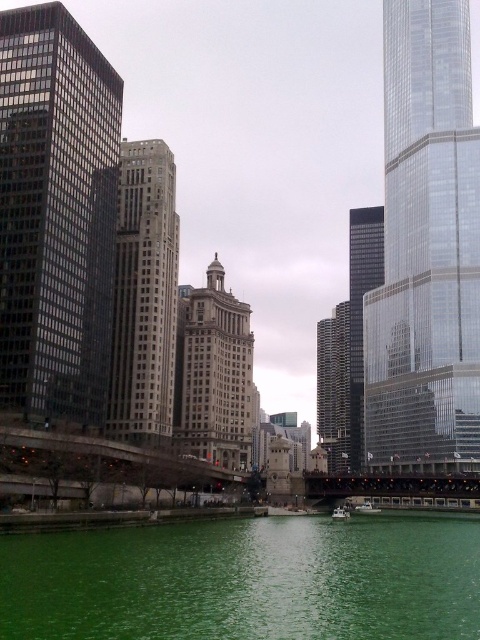
You are a photographer planning to capture the green liquid at lower center and the gray stone building at center in a single shot. Based on their heights, which object will appear smaller in the photo?

The green liquid at lower center will appear smaller in the photo because it has a lesser height compared to the gray stone building at center.

You are a photographer planning to capture the dark gray glass skyscraper at center and the white glossy boat at center in a single frame. Based on their sizes, which object should you focus on to ensure both are visible without needing to zoom in or out?

The dark gray glass skyscraper at center is wider than the white glossy boat at center, so focusing on the skyscraper will ensure both objects fit in the frame without needing to adjust the zoom.

You are standing at the camera position and want to pour the green liquid at lower center into a container that can hold up to 30 meters of liquid. Can you safely pour the liquid into the container without overfilling it?

The green liquid at lower center and camera are 29.25 meters apart from each other. Since the container can hold up to 30 meters, pouring the liquid would leave 0.75 meters of space, so yes, you can safely pour the liquid into the container without overfilling it.